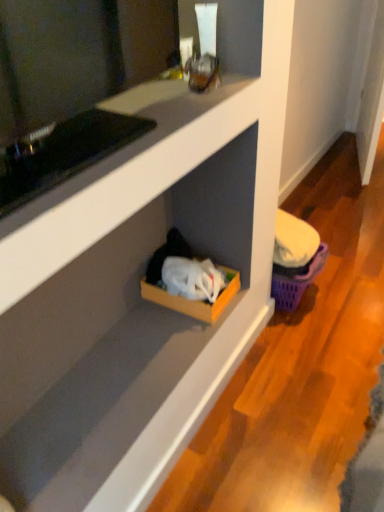
Locate an element on the screen. vacant space to the right of purple plastic basket at lower right is located at coordinates (346, 295).